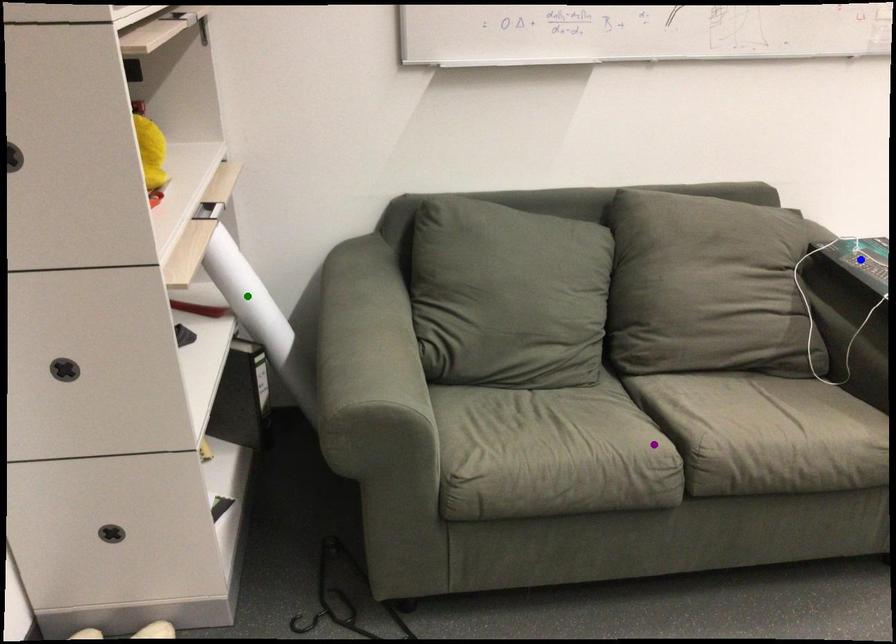
Order these from farthest to nearest:
blue point
green point
purple point

green point → blue point → purple point